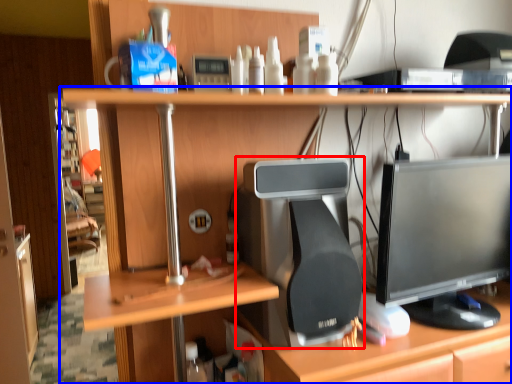
Question: Which point is closer to the camera, desktop computer (highlighted by a red box) or desk (highlighted by a blue box)?

Choices:
 (A) desktop computer
 (B) desk

Answer: (B)